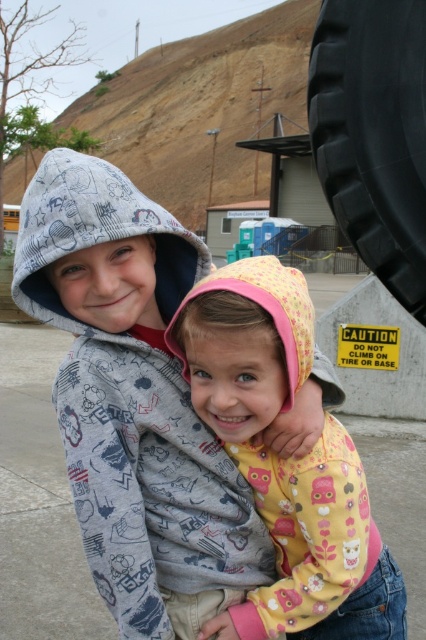
You are standing at the point marked by the coordinates point (198, 348) and want to walk towards the point marked by point (419, 170). Which direction should you turn to move closer to your destination?

You should turn towards the direction away from the viewer since point (198, 348) is closer to the viewer than point (419, 170). Moving away from the viewer will take you closer to point (419, 170).

You are a photographer trying to capture a clear shot of the gray cotton hoodie at center and the black rubber tire at upper right. Since the tire is behind the hoodie, will you need to adjust your camera angle to see both objects clearly?

Yes, you need to adjust your camera angle because the black rubber tire at upper right is behind the gray cotton hoodie at center, so it might be obscured. By moving the camera position or angle, you can ensure both objects are visible without obstruction.

You are a photographer trying to capture a photo of the yellow fabric hoodie at center and the black rubber tire at upper right. If you want to ensure both are in focus, which object should you focus on first considering their sizes?

The yellow fabric hoodie at center is bigger than the black rubber tire at upper right, so you should focus on the yellow fabric hoodie at center first to ensure both are in focus.